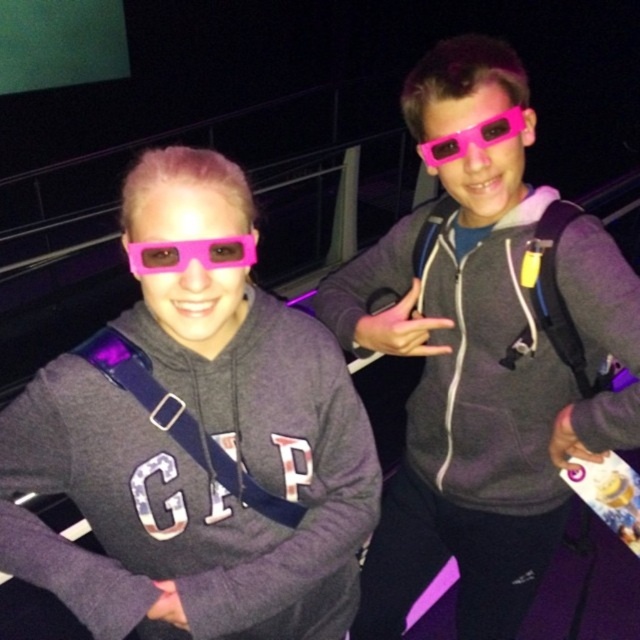
Question: Considering the relative positions of pink matte glasses at center and pink plastic glasses at upper center in the image provided, where is pink matte glasses at center located with respect to pink plastic glasses at upper center?

Choices:
 (A) right
 (B) left

Answer: (B)

Question: Which object is positioned farthest from the matte pink glasses at center?

Choices:
 (A) matte gray hoodie at center
 (B) pink plastic glasses at upper center

Answer: (B)

Question: Among these objects, which one is nearest to the camera?

Choices:
 (A) pink plastic glasses at upper center
 (B) matte pink glasses at center
 (C) matte gray hoodie at center

Answer: (B)

Question: Which of the following is the farthest from the observer?

Choices:
 (A) (236, 250)
 (B) (298, 380)

Answer: (B)

Question: In this image, where is matte pink glasses at center located relative to matte gray hoodie at center?

Choices:
 (A) above
 (B) below

Answer: (B)

Question: Can you confirm if matte pink glasses at center is smaller than matte gray hoodie at center?

Choices:
 (A) no
 (B) yes

Answer: (B)